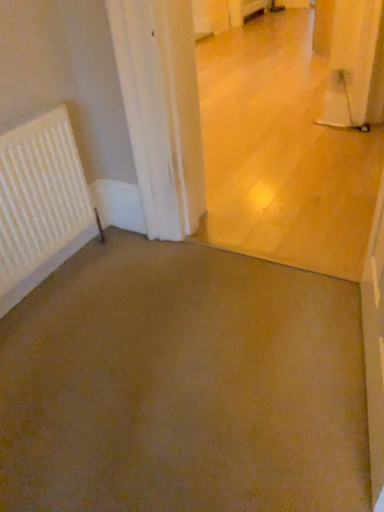
Question: In terms of width, does white matte radiator at left look wider or thinner when compared to brown carpet at lower left, the first concrete when ordered from bottom to top?

Choices:
 (A) wide
 (B) thin

Answer: (B)

Question: In terms of height, does white matte radiator at left look taller or shorter compared to brown carpet at lower left, arranged as the second concrete when viewed from the top?

Choices:
 (A) short
 (B) tall

Answer: (B)

Question: Estimate the real-world distances between objects in this image. Which object is closer to the brown carpet at lower left, the first concrete when ordered from bottom to top?

Choices:
 (A) white matte radiator at left
 (B) brown matte concrete at center, marked as the second concrete in a bottom-to-top arrangement

Answer: (A)

Question: Based on their relative distances, which object is farther from the brown carpet at lower left, arranged as the second concrete when viewed from the top?

Choices:
 (A) white matte radiator at left
 (B) brown matte concrete at center, marked as the second concrete in a bottom-to-top arrangement

Answer: (B)